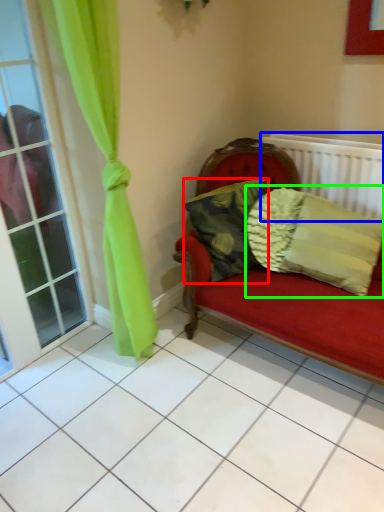
Question: Which is farther away from pillow (highlighted by a red box)? radiator (highlighted by a blue box) or pillow (highlighted by a green box)?

Choices:
 (A) radiator
 (B) pillow

Answer: (A)